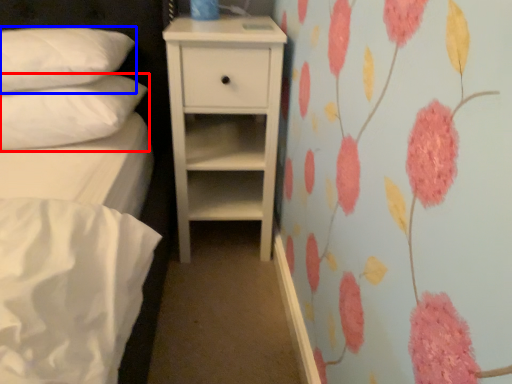
Question: Which object is further to the camera taking this photo, pillow (highlighted by a red box) or pillow (highlighted by a blue box)?

Choices:
 (A) pillow
 (B) pillow

Answer: (A)